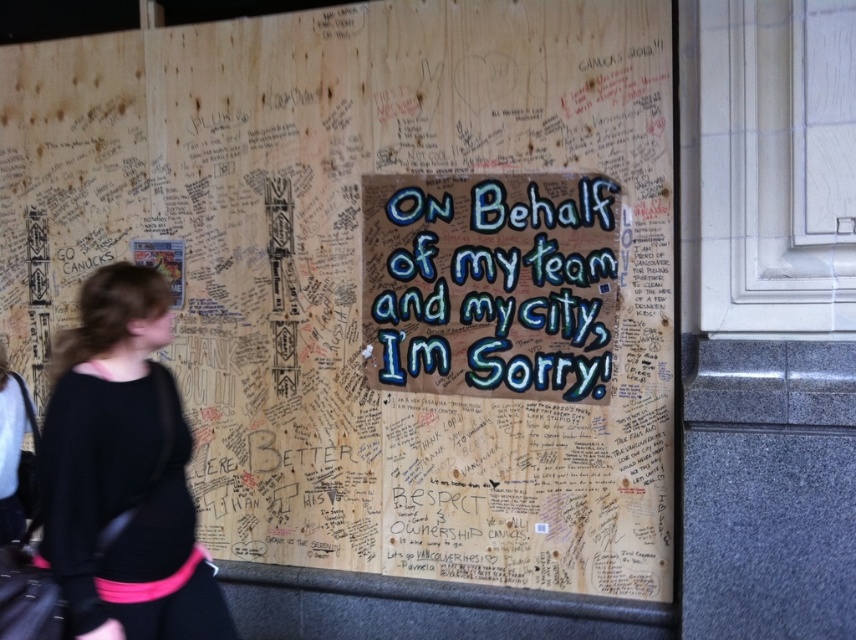
Who is higher up, blue painted wood sign at center or black sweater at left?

blue painted wood sign at center

Can you confirm if blue painted wood sign at center is positioned above black sweater at left?

Yes.

Where is `blue painted wood sign at center`? The height and width of the screenshot is (640, 856). blue painted wood sign at center is located at coordinates (489, 284).